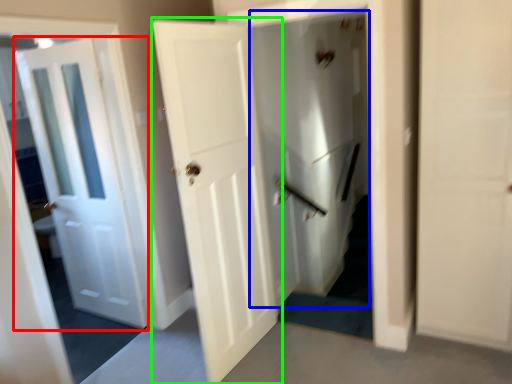
Question: Considering the real-world distances, which object is closest to door (highlighted by a red box)? elevator (highlighted by a blue box) or door (highlighted by a green box).

Choices:
 (A) elevator
 (B) door

Answer: (B)